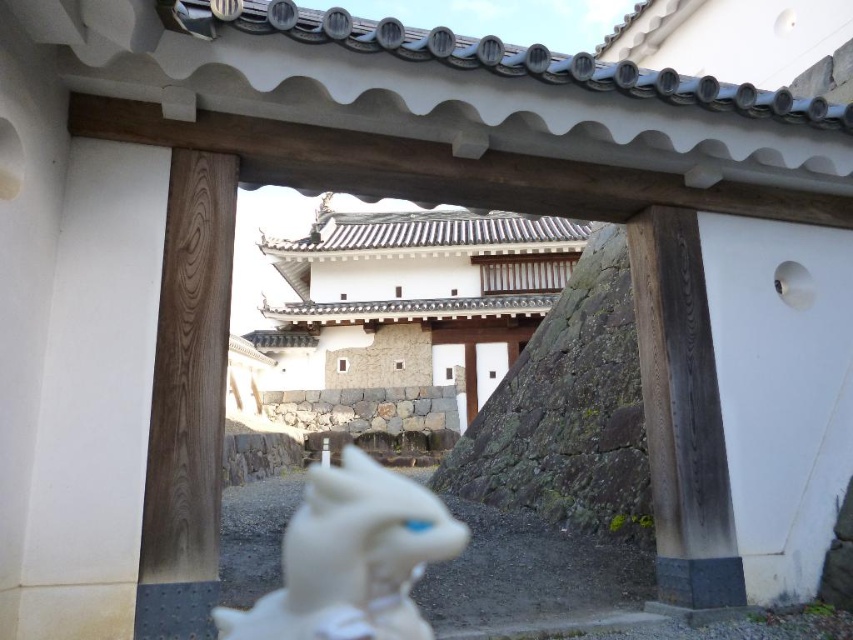
Between white glossy statue at center and stone wall at center, which one has more height?

Standing taller between the two is stone wall at center.

Does white glossy statue at center appear over stone wall at center?

Indeed, white glossy statue at center is positioned over stone wall at center.

Between point (360, 536) and point (471, 396), which one is positioned in front?

Point (360, 536)

Locate an element on the screen. This screenshot has width=853, height=640. white glossy statue at center is located at coordinates (351, 557).